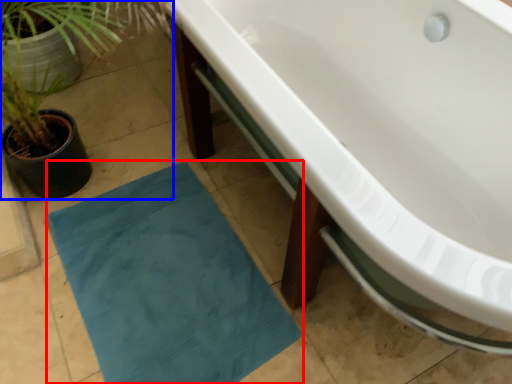
Question: Which object is closer to the camera taking this photo, bath mat (highlighted by a red box) or houseplant (highlighted by a blue box)?

Choices:
 (A) bath mat
 (B) houseplant

Answer: (B)